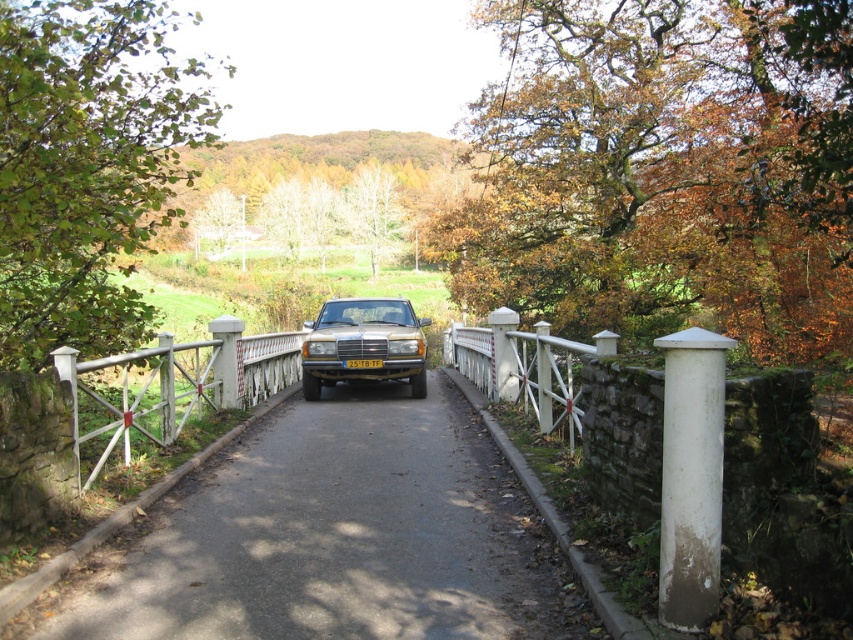
Is gold metallic car at center thinner than yellow matte license plate at center?

No.

Which is behind, point (392, 339) or point (352, 362)?

Positioned behind is point (352, 362).

You are a GUI agent. You are given a task and a screenshot of the screen. Output one action in this format:
    pyautogui.click(x=<x>, y=<y>)
    Task: Click on the gold metallic car at center
    The height and width of the screenshot is (640, 853).
    Given the screenshot: What is the action you would take?
    [364, 342]

Does point (103, 364) come farther from viewer compared to point (363, 362)?

No, (103, 364) is in front of (363, 362).

Can you confirm if white painted wood fence at center is taller than yellow matte license plate at center?

Yes, white painted wood fence at center is taller than yellow matte license plate at center.

This screenshot has height=640, width=853. Describe the element at coordinates (169, 387) in the screenshot. I see `white painted wood fence at center` at that location.

Where is `white painted wood fence at center`? This screenshot has height=640, width=853. white painted wood fence at center is located at coordinates (169, 387).

This screenshot has width=853, height=640. Find the location of `black asphalt road at center`. black asphalt road at center is located at coordinates (338, 538).

This screenshot has width=853, height=640. What do you see at coordinates (338, 538) in the screenshot?
I see `black asphalt road at center` at bounding box center [338, 538].

Does point (180, 515) come closer to viewer compared to point (148, 429)?

That is True.

The width and height of the screenshot is (853, 640). Find the location of `black asphalt road at center`. black asphalt road at center is located at coordinates (338, 538).